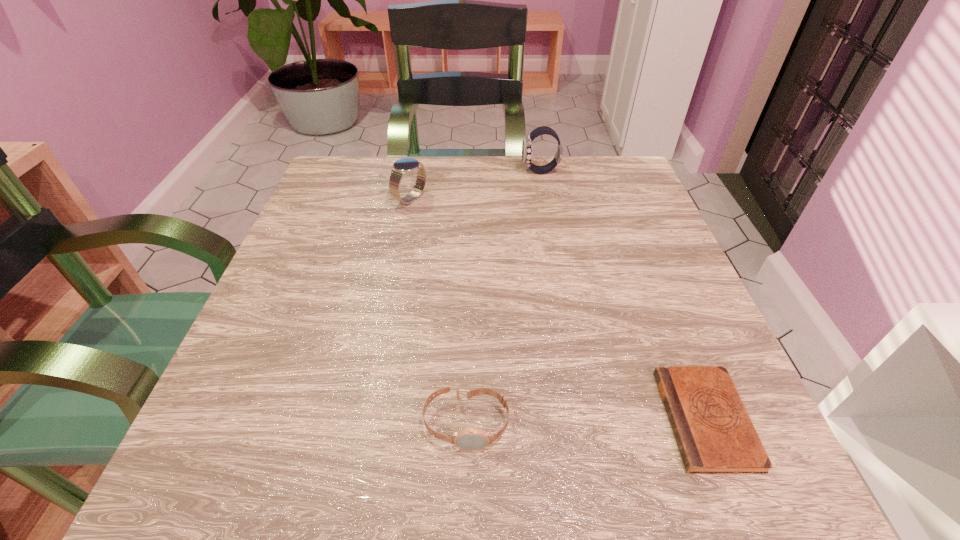
Locate an element on the screen. The height and width of the screenshot is (540, 960). vacant position in the image that satisfies the following two spatial constraints: 1. on the face of the rightmost watch; 2. on the face of the nearest watch is located at coordinates (588, 423).

Find the location of a particular element. blank area in the image that satisfies the following two spatial constraints: 1. on the spine side of the rightmost object; 2. on the face of the nearest watch is located at coordinates (708, 423).

The image size is (960, 540). Find the location of `free location that satisfies the following two spatial constraints: 1. on the face of the rightmost watch; 2. on the face of the second shortest object`. free location that satisfies the following two spatial constraints: 1. on the face of the rightmost watch; 2. on the face of the second shortest object is located at coordinates (588, 423).